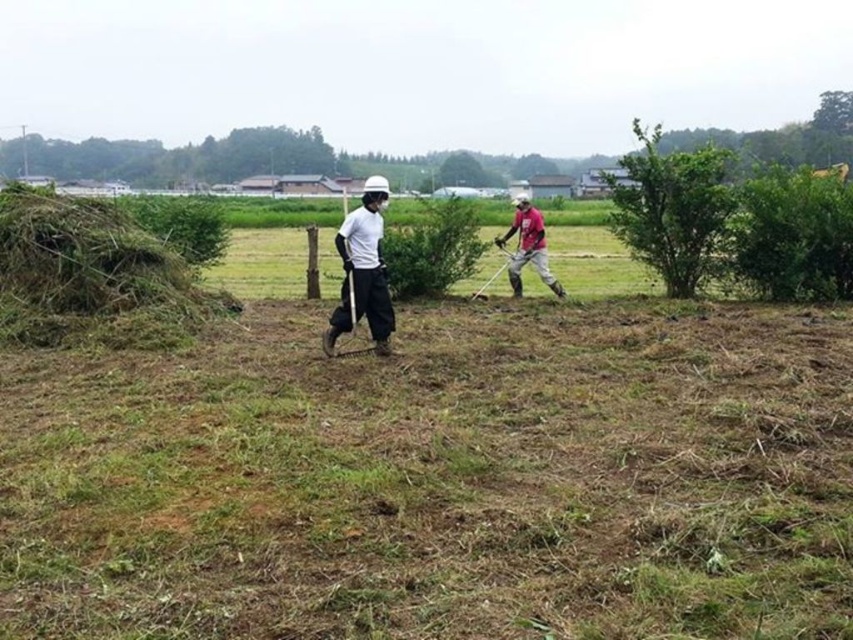
Consider the image. You are a safety inspector checking the field. You need to ensure that the workers are spaced apart for safety. Given that the white matte shirt at center and the matte pink shirt at center are both working in the same area, which worker has a smaller body size?

The white matte shirt at center has a smaller body size than the matte pink shirt at center because its width is less than the latter.